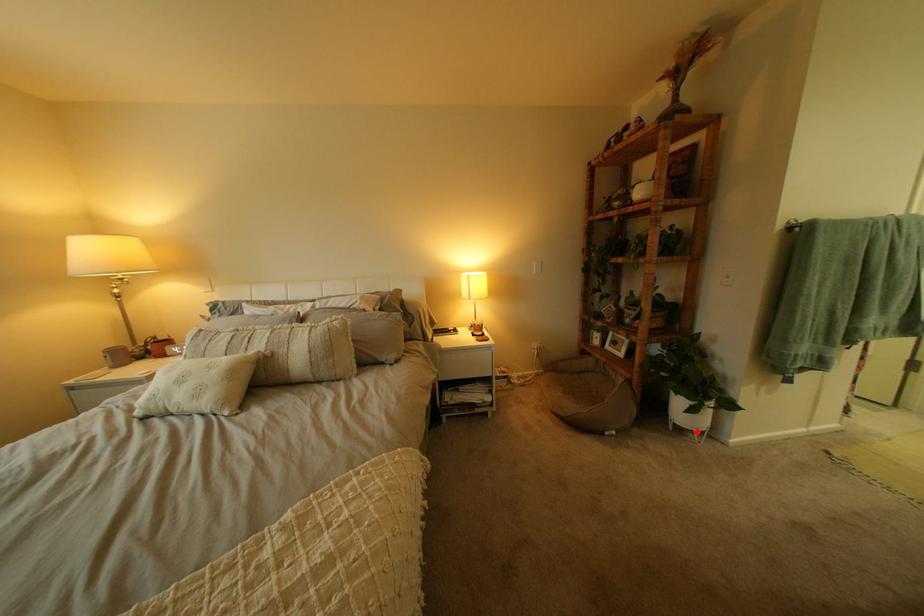
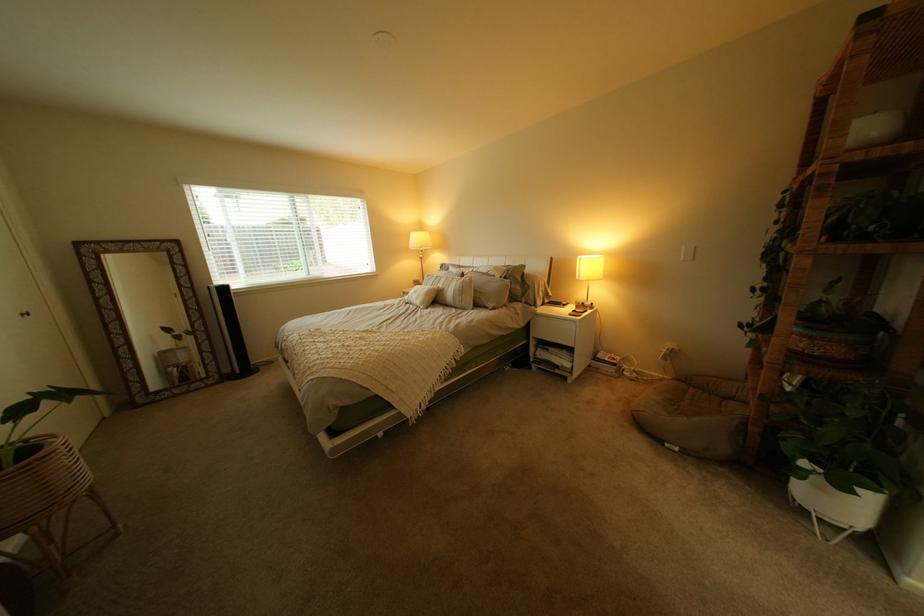
Where in the second image is the point corresponding to the highlighted location from the first image?

(821, 512)